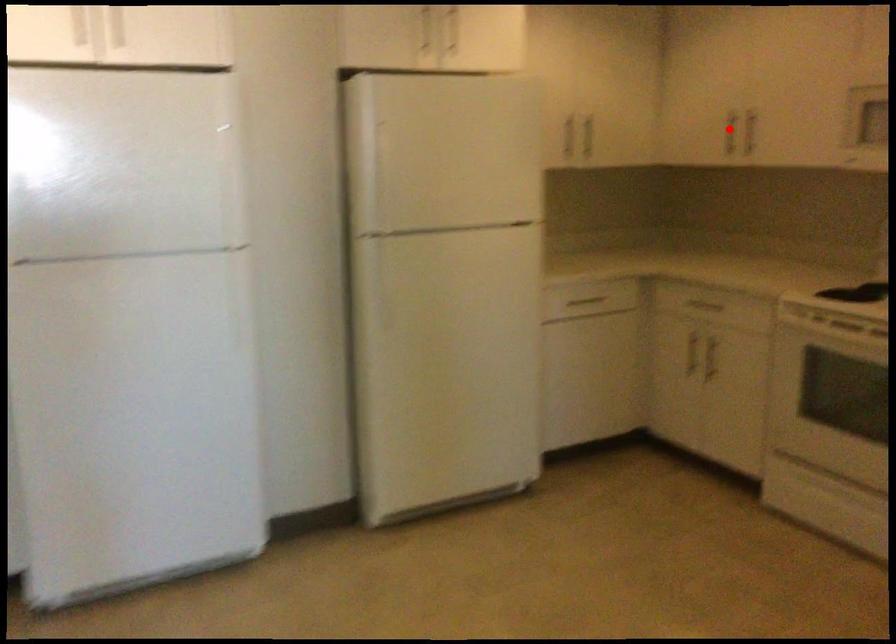
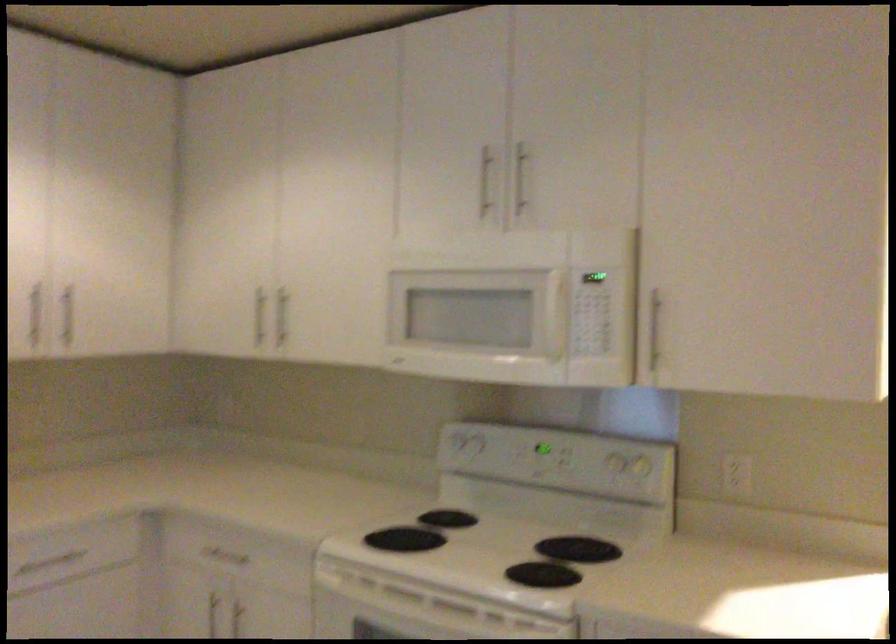
The point at the highlighted location is marked in the first image. Where is the corresponding point in the second image?

(259, 316)